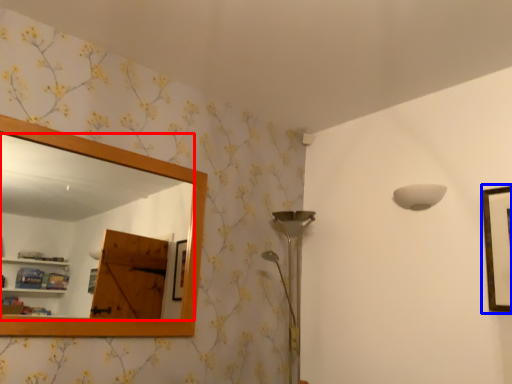
Question: Among these objects, which one is farthest to the camera, mirror (highlighted by a red box) or picture frame (highlighted by a blue box)?

Choices:
 (A) mirror
 (B) picture frame

Answer: (B)